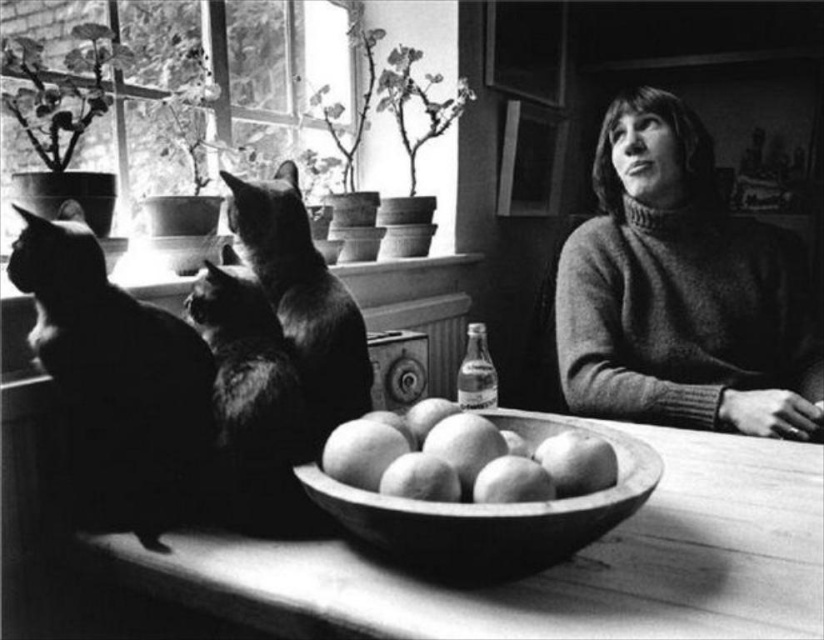
You are arranging items on a wooden table in the kitchen. You have a wooden bowl of apples at center and a wooden bowl at center. Which bowl should you choose if you need a larger container for more fruits?

The wooden bowl of apples at center is larger in size than the wooden bowl at center, so you should choose the wooden bowl of apples at center for more fruits.

From the picture: You are standing in the kitchen scene and want to reach both the point at coordinates (136, 541) and the point at (442, 504). Which point is closer to you?

Point (442, 504) is closer to you because point (136, 541) is behind it.

You are organizing a small display on a table and have a knitted sweater at right and a smooth wooden bowl at center. Which object takes up more vertical space?

The knitted sweater at right is much taller than the smooth wooden bowl at center, so it takes up more vertical space.